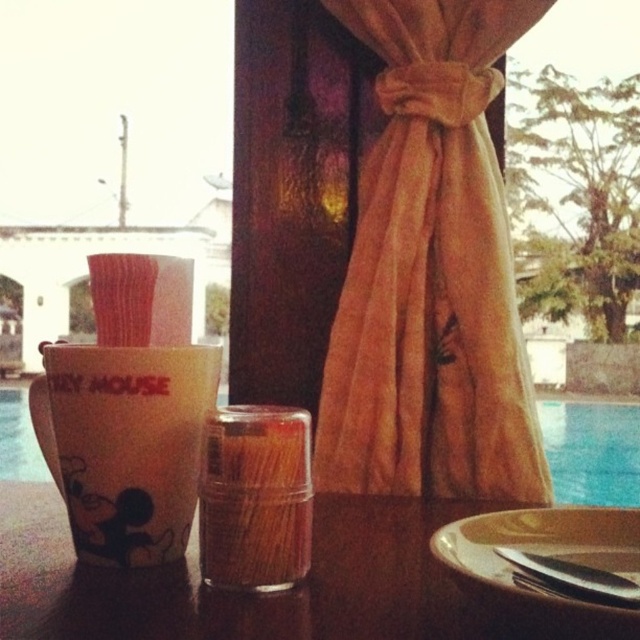
Can you confirm if white glossy cup at left is taller than translucent plastic toothpicks at center?

Yes.

The height and width of the screenshot is (640, 640). What do you see at coordinates (129, 445) in the screenshot?
I see `white glossy cup at left` at bounding box center [129, 445].

The image size is (640, 640). I want to click on white glossy cup at left, so click(129, 445).

Can you confirm if translucent plastic toothpicks at center is wider than shiny metallic knife at lower right?

Yes.

Can you confirm if translucent plastic toothpicks at center is positioned to the right of shiny metallic knife at lower right?

Incorrect, translucent plastic toothpicks at center is not on the right side of shiny metallic knife at lower right.

What do you see at coordinates (256, 499) in the screenshot? The width and height of the screenshot is (640, 640). I see `translucent plastic toothpicks at center` at bounding box center [256, 499].

The image size is (640, 640). I want to click on translucent plastic toothpicks at center, so (256, 499).

Which of these two, velvet gold curtain at center or blue glass at upper right, stands shorter?

With less height is blue glass at upper right.

Between velvet gold curtain at center and blue glass at upper right, which one appears on the left side from the viewer's perspective?

Positioned to the left is velvet gold curtain at center.

Is point (540, 493) behind point (561, 440)?

No, (540, 493) is closer to viewer.

I want to click on velvet gold curtain at center, so click(x=432, y=273).